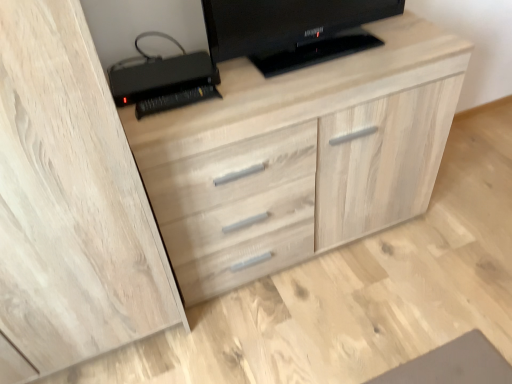
At what (x,y) coordinates should I click in order to perform the action: click on free point below black glossy television at upper center (from a real-world perspective). Please return your answer as a coordinate pair (x, y). Looking at the image, I should click on (344, 51).